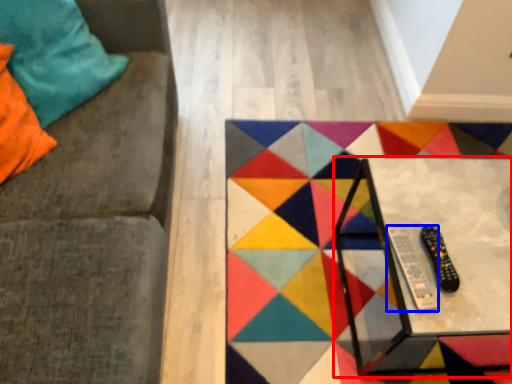
Question: Which object is closer to the camera taking this photo, table (highlighted by a red box) or remote (highlighted by a blue box)?

Choices:
 (A) table
 (B) remote

Answer: (A)